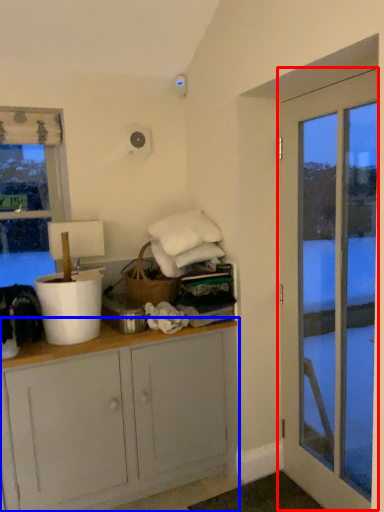
Question: Which object appears farthest to the camera in this image, door (highlighted by a red box) or cabinetry (highlighted by a blue box)?

Choices:
 (A) door
 (B) cabinetry

Answer: (B)